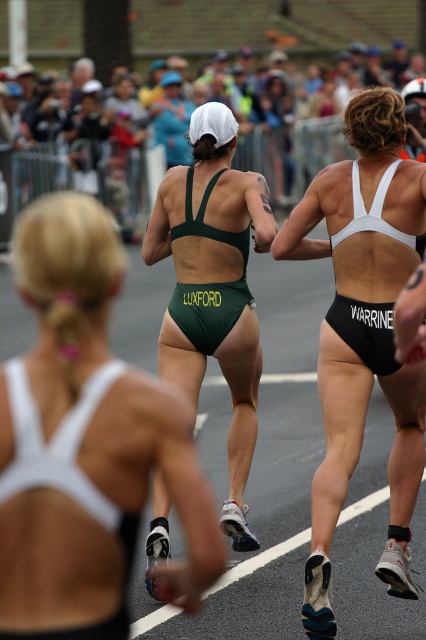
Based on the photo, based on the scene description, can you determine the spatial relationship between the white matte sports bra at upper center and the green matte swimsuit at center?

The white matte sports bra at upper center is positioned under the green matte swimsuit at center.

You are a photographer positioned at the starting line of the race. You need to capture a photo that includes both the white matte sports bra at upper center and the green matte swimsuit at center. Based on their widths, which object should you adjust your camera focus to ensure both are fully visible in the frame?

The white matte sports bra at upper center has a smaller width compared to the green matte swimsuit at center. To ensure both are fully visible, adjust the camera focus to accommodate the wider green matte swimsuit at center, as it requires more space in the frame.